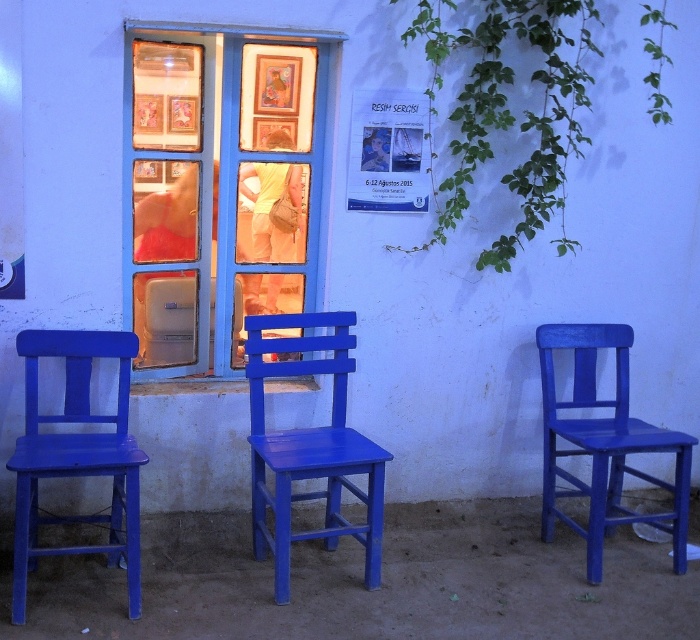
You are standing in a room with a blue painted wood window at center and a matte blue chair at right. If you want to hang a poster that requires a taller surface, which object would be more suitable for hanging?

The blue painted wood window at center is much taller than the matte blue chair at right, so it would be more suitable for hanging a poster that requires a taller surface.

You are an interior designer planning to place a new lamp next to the matte wood chair at left and the matte paper poster at center. Considering their sizes, which object requires more space for the lamp to fit comfortably?

The matte wood chair at left requires more space for the lamp to fit comfortably since it has a larger size compared to the matte paper poster at center.

You are standing in a room with three blue chairs against a white wall and a window with framed pictures. There is a specific point marked at coordinates [218,188]. What object is located at this point?

The point at coordinates [218,188] corresponds to the blue painted wood window at center.